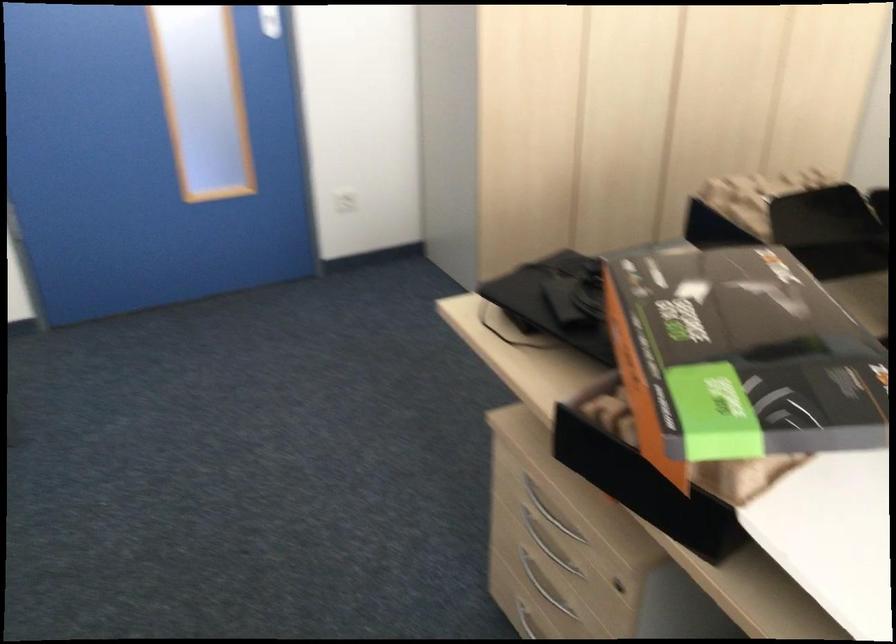
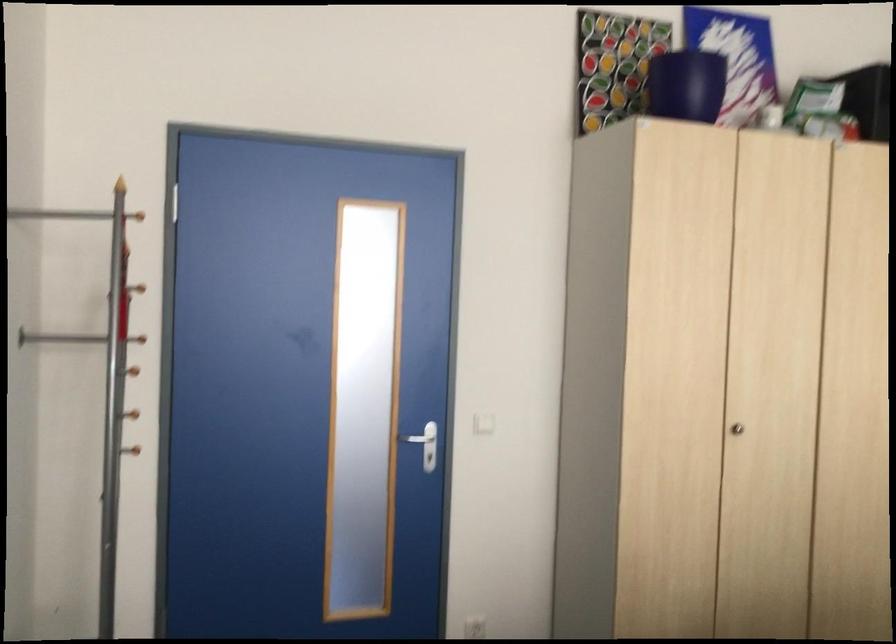
Question: The images are taken continuously from a first-person perspective. In which direction is your viewpoint rotating?

Choices:
 (A) Left
 (B) Right
 (C) Up
 (D) Down

Answer: (C)